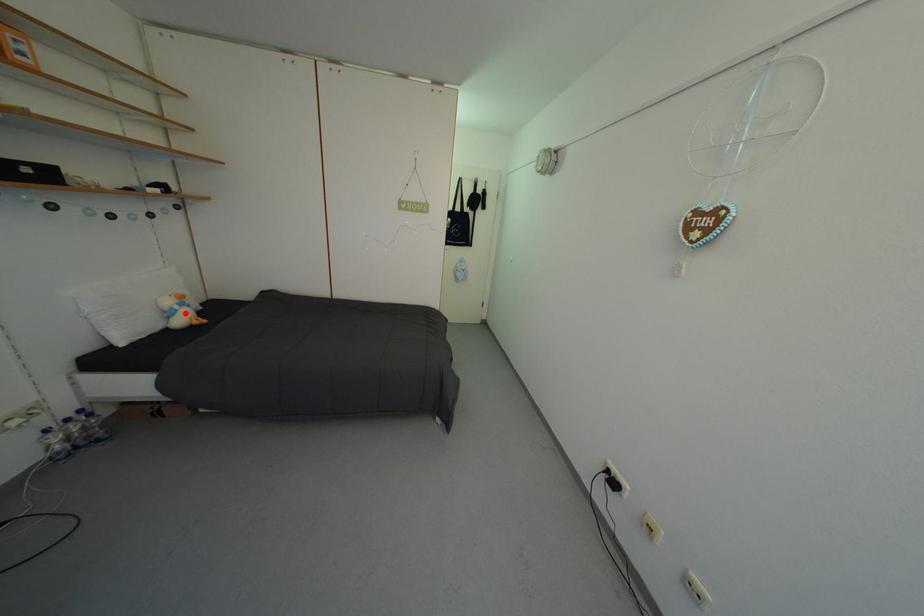
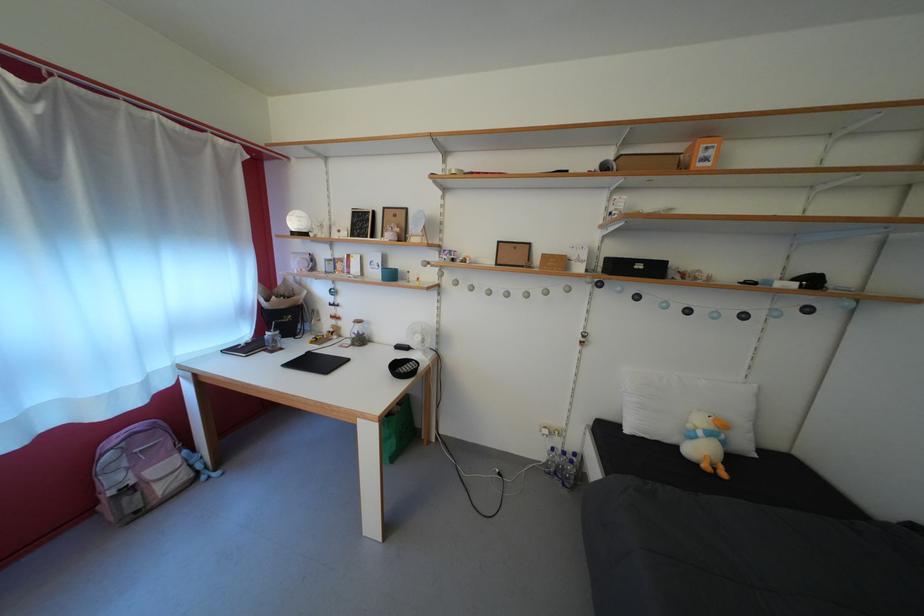
Find the pixel in the second image that matches the highlighted location in the first image.

(709, 439)